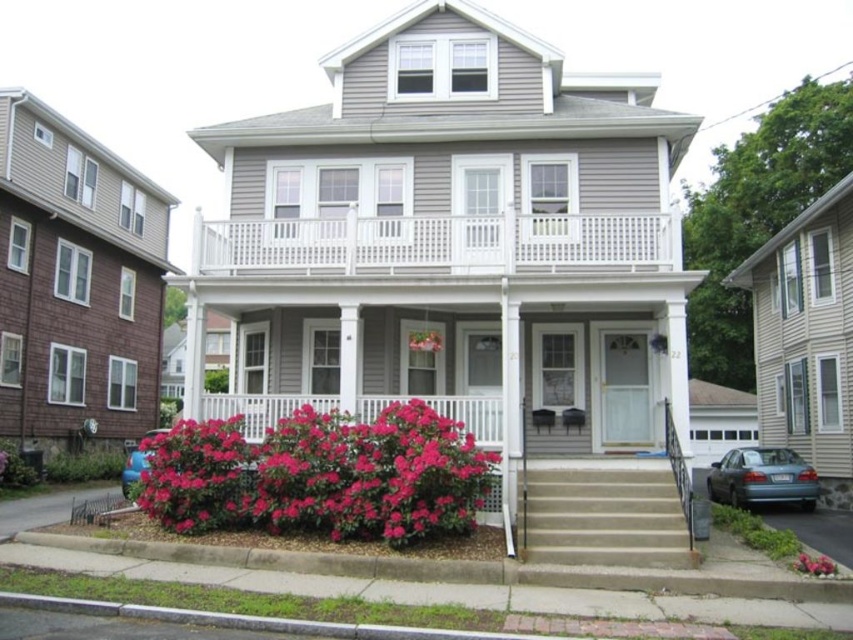
Which is more to the left, pink matte flower at lower right or pink matte flower at center?

From the viewer's perspective, pink matte flower at center appears more on the left side.

Does pink matte flower at lower right have a lesser height compared to pink matte flower at center?

Yes, pink matte flower at lower right is shorter than pink matte flower at center.

Is point (828, 570) positioned before point (426, 348)?

That is True.

Where is `pink matte flower at lower right`? pink matte flower at lower right is located at coordinates (814, 564).

Which is behind, point (418, 449) or point (805, 557)?

Positioned behind is point (418, 449).

Describe the element at coordinates (321, 476) in the screenshot. I see `vivid pink petals at lower center` at that location.

Does point (413, 458) come closer to viewer compared to point (831, 561)?

That is False.

In order to click on vivid pink petals at lower center in this screenshot , I will do `click(321, 476)`.

Consider the image. Which is more to the right, teal metallic sedan at lower right or pink matte flower at center?

teal metallic sedan at lower right

Based on the photo, who is higher up, teal metallic sedan at lower right or pink matte flower at center?

pink matte flower at center

The height and width of the screenshot is (640, 853). Find the location of `teal metallic sedan at lower right`. teal metallic sedan at lower right is located at coordinates (762, 477).

The height and width of the screenshot is (640, 853). What are the coordinates of `teal metallic sedan at lower right` in the screenshot? It's located at (762, 477).